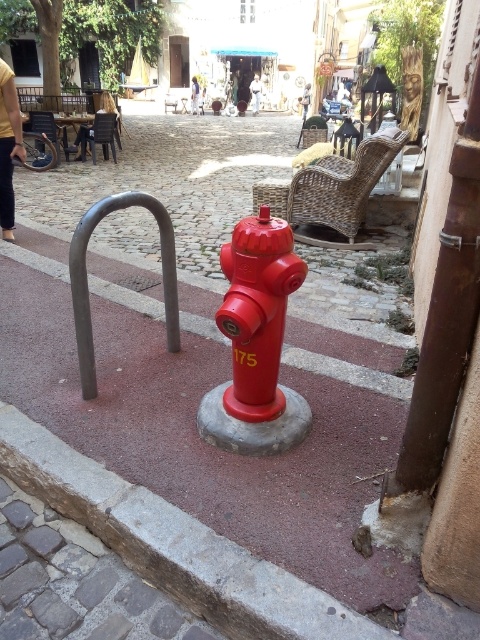
Question: Which object is the closest to the woven rattan chair at center?

Choices:
 (A) rusty metal pole at right
 (B) shiny red fire hydrant at center
 (C) polished metal bike rack at center

Answer: (C)

Question: Which of the following is the farthest from the observer?

Choices:
 (A) woven rattan chair at center
 (B) rusty metal pole at right
 (C) shiny red fire hydrant at center
 (D) polished metal bike rack at center

Answer: (A)

Question: Observing the image, what is the correct spatial positioning of rusty metal pole at right in reference to woven rattan chair at center?

Choices:
 (A) above
 (B) below

Answer: (B)

Question: Which point is closer to the camera?

Choices:
 (A) woven rattan chair at center
 (B) shiny red fire hydrant at center

Answer: (B)

Question: Can you confirm if gray concrete curb at center is positioned below woven rattan chair at center?

Choices:
 (A) no
 (B) yes

Answer: (B)

Question: Does rusty metal pole at right have a smaller size compared to woven rattan chair at center?

Choices:
 (A) no
 (B) yes

Answer: (B)